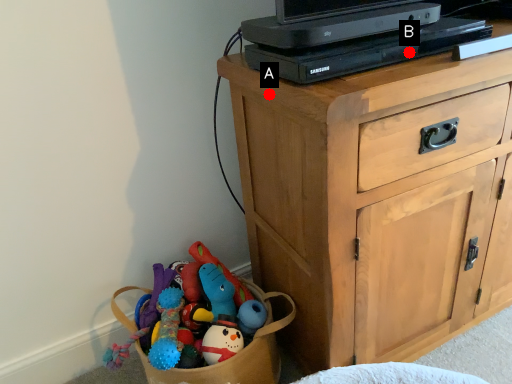
Question: Two points are circled on the image, labeled by A and B beside each circle. Which point appears closest to the camera in this image?

Choices:
 (A) A is closer
 (B) B is closer

Answer: (B)